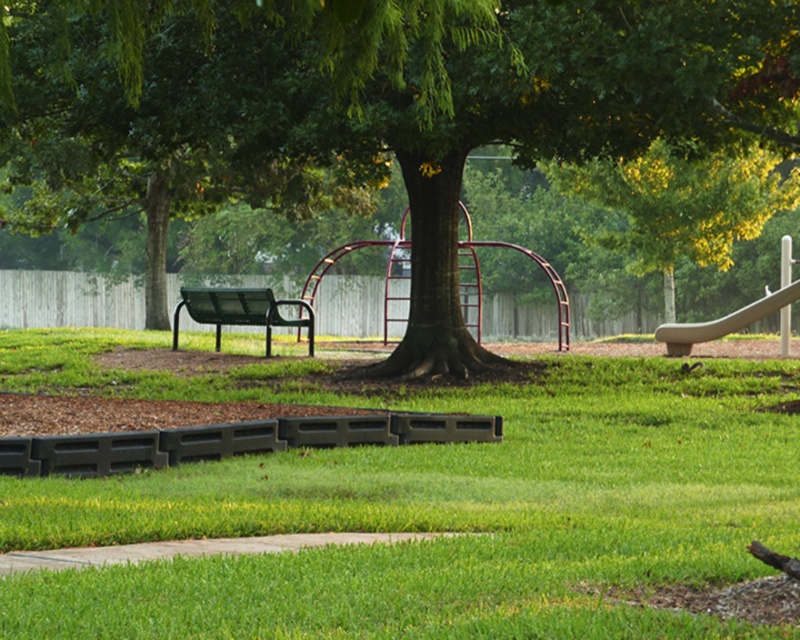
Consider the image. Is green grass at center taller than green textured tree at center?

No, green grass at center is not taller than green textured tree at center.

Who is more distant from viewer, (449, 568) or (140, 20)?

The point (140, 20) is behind.

What are the coordinates of `green grass at center` in the screenshot? It's located at (422, 506).

Image resolution: width=800 pixels, height=640 pixels. In order to click on green grass at center in this screenshot , I will do `click(422, 506)`.

This screenshot has height=640, width=800. I want to click on green textured tree at center, so click(376, 104).

Does point (458, 170) lie behind point (240, 305)?

No, it is not.

Find the location of `green textured tree at center`. green textured tree at center is located at coordinates (376, 104).

Can you confirm if green textured tree at center is positioned to the left of smooth gray slide at right?

Correct, you'll find green textured tree at center to the left of smooth gray slide at right.

Who is taller, green textured tree at center or smooth gray slide at right?

Standing taller between the two is green textured tree at center.

The image size is (800, 640). What do you see at coordinates (376, 104) in the screenshot?
I see `green textured tree at center` at bounding box center [376, 104].

Locate an element on the screen. The image size is (800, 640). green textured tree at center is located at coordinates (376, 104).